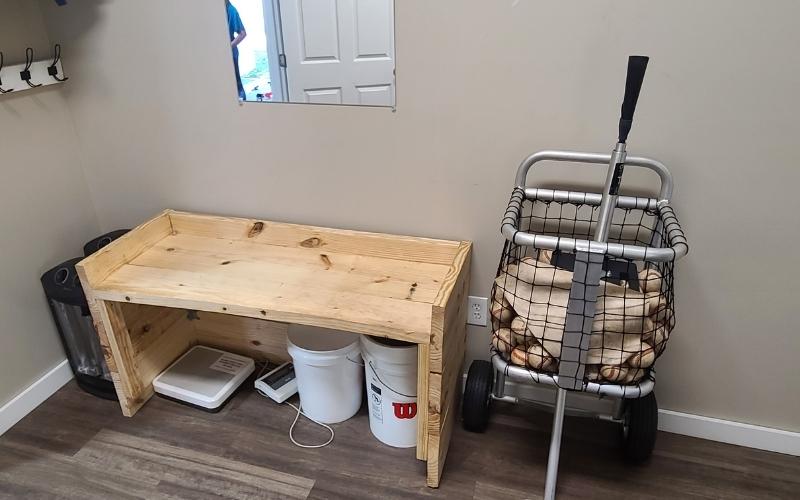
Identify the location of door. This screenshot has height=500, width=800. (350, 78).